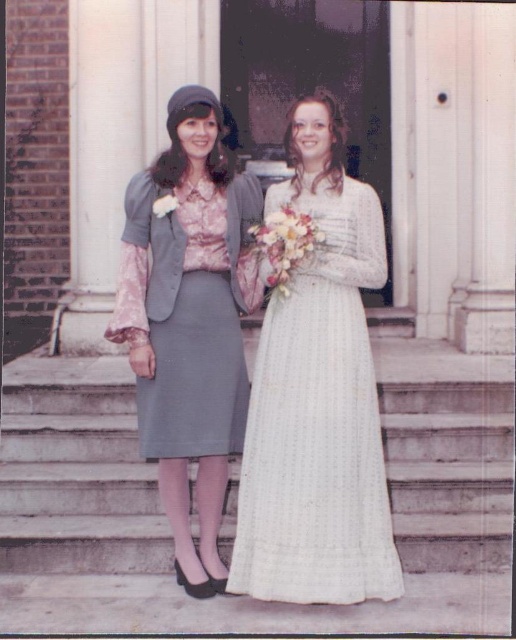
Is smooth concrete stairs at center further to the viewer compared to matte gray skirt at center?

No.

The image size is (516, 640). Identify the location of smooth concrete stairs at center. (169, 531).

Where is `smooth concrete stairs at center`? smooth concrete stairs at center is located at coordinates (169, 531).

Which is more to the left, smooth concrete stairs at center or white textured dress at center?

From the viewer's perspective, smooth concrete stairs at center appears more on the left side.

Who is positioned more to the right, smooth concrete stairs at center or white textured dress at center?

white textured dress at center is more to the right.

Which is behind, point (114, 595) or point (264, 369)?

The point (264, 369) is more distant.

Find the location of a particular element. This screenshot has height=640, width=516. smooth concrete stairs at center is located at coordinates (169, 531).

The height and width of the screenshot is (640, 516). What do you see at coordinates (317, 419) in the screenshot? I see `white textured dress at center` at bounding box center [317, 419].

Which of these two, white textured dress at center or matte gray skirt at center, stands shorter?

white textured dress at center

Between point (272, 189) and point (157, 168), which one is positioned in front?

Positioned in front is point (157, 168).

The image size is (516, 640). Find the location of `white textured dress at center`. white textured dress at center is located at coordinates (317, 419).